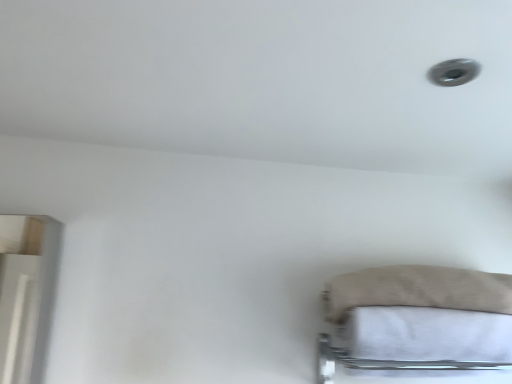
Question: From the image's perspective, is beige fabric pillow at lower right located above or below white cotton sheet at lower right?

Choices:
 (A) above
 (B) below

Answer: (A)

Question: From their relative heights in the image, would you say beige fabric pillow at lower right is taller or shorter than white cotton sheet at lower right?

Choices:
 (A) short
 (B) tall

Answer: (A)

Question: Is point (349, 286) positioned closer to the camera than point (488, 337)?

Choices:
 (A) farther
 (B) closer

Answer: (A)

Question: From a real-world perspective, is white cotton sheet at lower right positioned above or below beige fabric pillow at lower right?

Choices:
 (A) below
 (B) above

Answer: (A)

Question: From their relative heights in the image, would you say white cotton sheet at lower right is taller or shorter than beige fabric pillow at lower right?

Choices:
 (A) tall
 (B) short

Answer: (A)

Question: From the image's perspective, is white cotton sheet at lower right above or below beige fabric pillow at lower right?

Choices:
 (A) below
 (B) above

Answer: (A)

Question: Considering their positions, is white cotton sheet at lower right located in front of or behind beige fabric pillow at lower right?

Choices:
 (A) behind
 (B) front

Answer: (B)